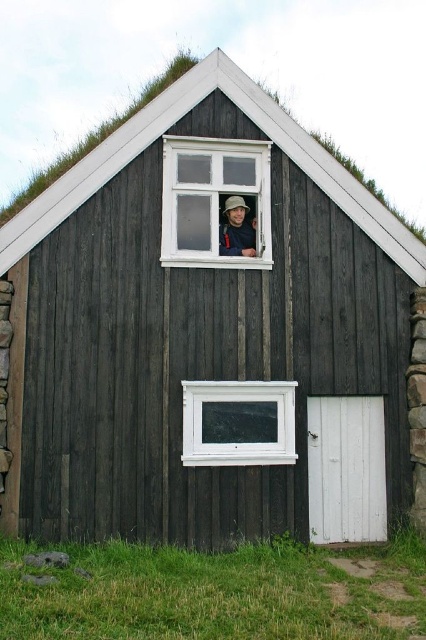
Question: Does white wood window at upper center have a larger size compared to white plastic window at lower center?

Choices:
 (A) no
 (B) yes

Answer: (B)

Question: Can you confirm if white plastic window at lower center is thinner than matte black hat at upper center?

Choices:
 (A) yes
 (B) no

Answer: (B)

Question: Estimate the real-world distances between objects in this image. Which object is closer to the white plastic window at lower center?

Choices:
 (A) matte black hat at upper center
 (B) white wood window at upper center

Answer: (B)

Question: Which object is the farthest from the matte black hat at upper center?

Choices:
 (A) white wood window at upper center
 (B) white plastic window at lower center

Answer: (B)

Question: Can you confirm if white wood window at upper center is positioned to the right of matte black hat at upper center?

Choices:
 (A) no
 (B) yes

Answer: (A)

Question: Which point is closer to the camera?

Choices:
 (A) white plastic window at lower center
 (B) matte black hat at upper center
 (C) white wood window at upper center

Answer: (A)